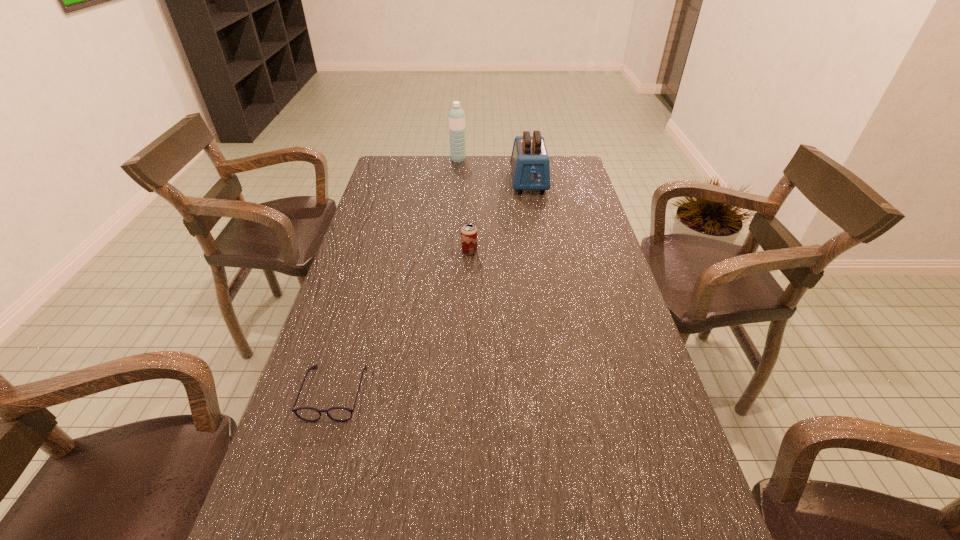
This screenshot has height=540, width=960. In order to click on free space between the water bottle and the toaster in this screenshot , I will do `click(493, 170)`.

Identify the location of free spot between the third tallest object and the rightmost object. (499, 216).

The image size is (960, 540). What are the coordinates of `free spot between the shortest object and the third object from left to right` in the screenshot? It's located at (402, 322).

Locate an element on the screen. unoccupied position between the beer can and the water bottle is located at coordinates (464, 205).

Where is `vacant area that lies between the beer can and the water bottle`? The width and height of the screenshot is (960, 540). vacant area that lies between the beer can and the water bottle is located at coordinates (464, 205).

Identify the location of empty space that is in between the beer can and the rightmost object. (499, 216).

Find the location of `vacant space that's between the tallest object and the second farthest object`. vacant space that's between the tallest object and the second farthest object is located at coordinates (493, 170).

The width and height of the screenshot is (960, 540). Identify the location of blank region between the leftmost object and the second tallest object. (432, 287).

Where is `unoccupied position between the spectacles and the third shortest object`? The width and height of the screenshot is (960, 540). unoccupied position between the spectacles and the third shortest object is located at coordinates (432, 287).

The image size is (960, 540). Identify the location of vacant area between the third object from left to right and the rightmost object. (499, 216).